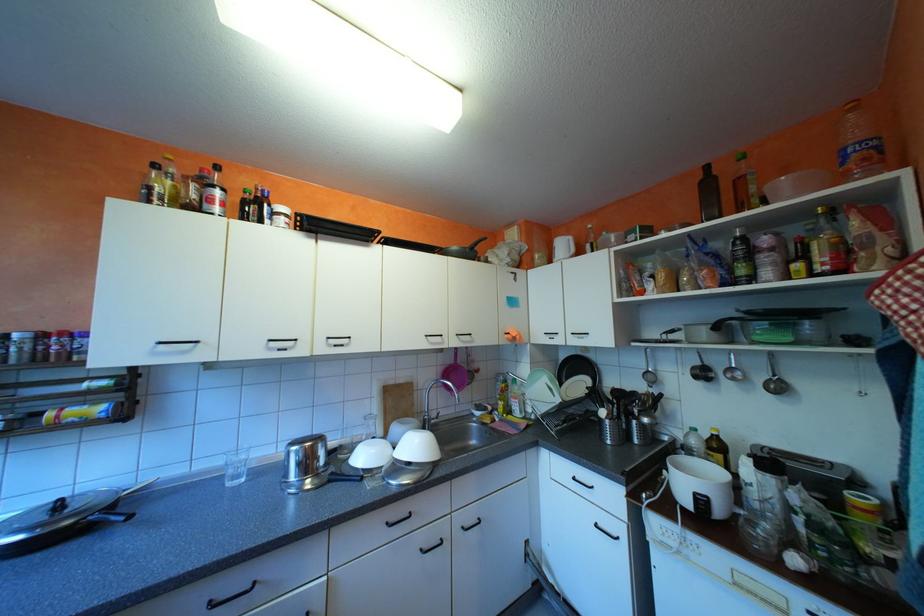
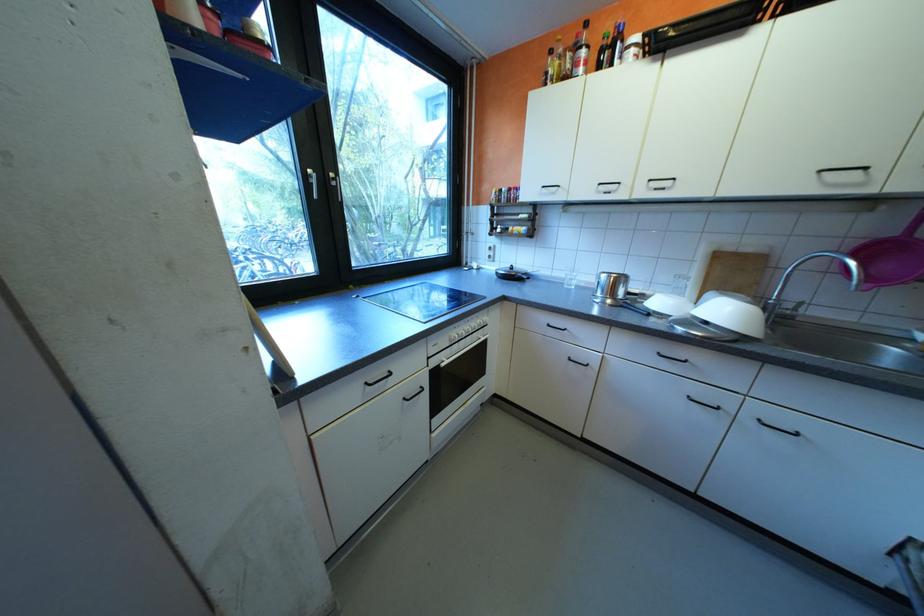
Where in the second image is the point corresponding to (233,468) from the first image?

(576, 278)